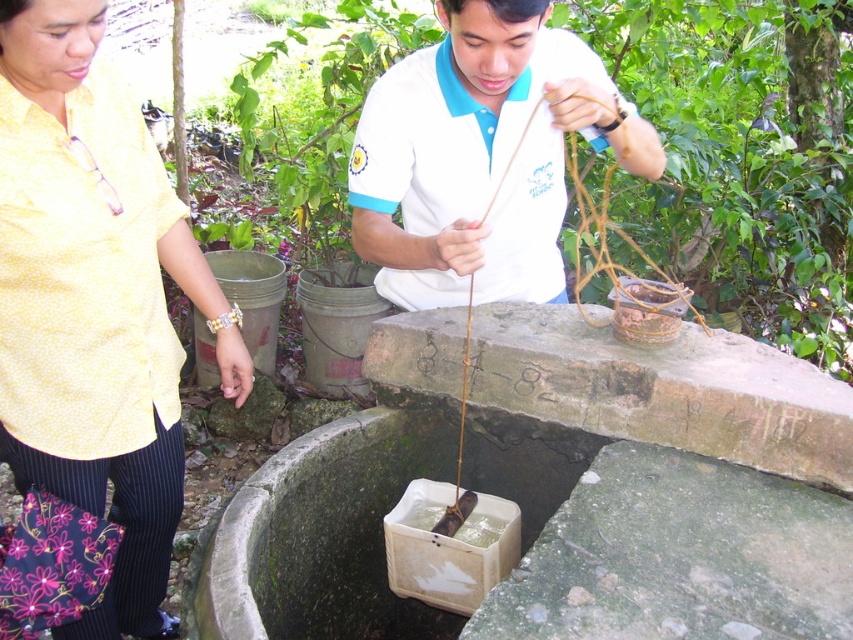
Between point (345, 83) and point (0, 13), which one is positioned in front?

Point (0, 13)

This screenshot has height=640, width=853. Find the location of `brown woven basket at center`. brown woven basket at center is located at coordinates (741, 157).

Where is `brown woven basket at center`? brown woven basket at center is located at coordinates (741, 157).